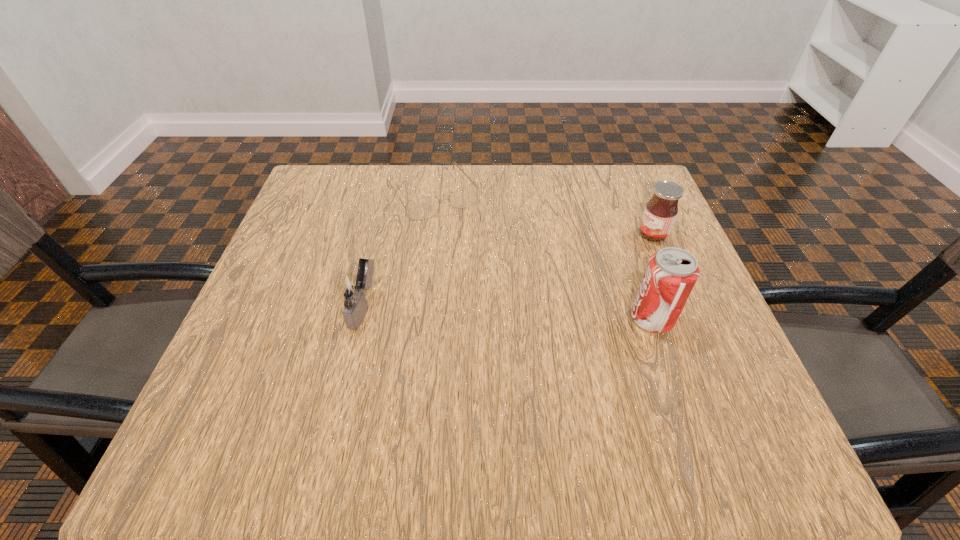
The image size is (960, 540). I want to click on vacant space at the near left corner of the desktop, so click(254, 368).

In the image, there is a desktop. Where is `vacant space at the far right corner`? This screenshot has width=960, height=540. vacant space at the far right corner is located at coordinates (645, 178).

Where is `free space between the shortest object and the igniter`? free space between the shortest object and the igniter is located at coordinates (396, 250).

Where is `free space between the igniter and the shortest object`? The height and width of the screenshot is (540, 960). free space between the igniter and the shortest object is located at coordinates point(396,250).

Where is `free point between the second farthest object and the spectacles`? free point between the second farthest object and the spectacles is located at coordinates (542, 214).

You are a GUI agent. You are given a task and a screenshot of the screen. Output one action in this format:
    pyautogui.click(x=<x>, y=<y>)
    Task: Click on the free space between the second farthest object and the igniter
    The image size is (960, 540).
    Given the screenshot: What is the action you would take?
    pyautogui.click(x=507, y=271)

At what (x,y) coordinates should I click in order to perform the action: click on free space between the shortest object and the soda can. Please return your answer as a coordinate pair (x, y). Looking at the image, I should click on (541, 256).

You are a GUI agent. You are given a task and a screenshot of the screen. Output one action in this format:
    pyautogui.click(x=<x>, y=<y>)
    Task: Click on the free space between the soda can and the spectacles
    
    Given the screenshot: What is the action you would take?
    (x=541, y=256)

This screenshot has width=960, height=540. In order to click on free area in between the third nearest object and the igniter in this screenshot , I will do `click(507, 271)`.

Where is `vacant point located between the igniter and the jam`? The width and height of the screenshot is (960, 540). vacant point located between the igniter and the jam is located at coordinates (507, 271).